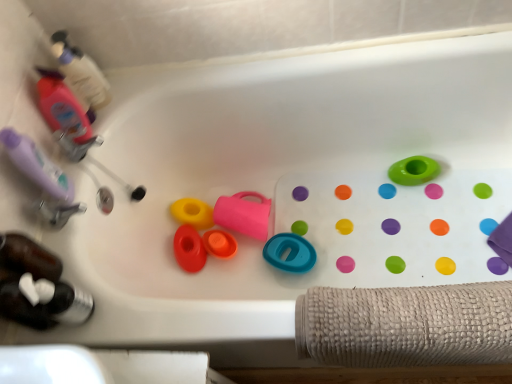
The height and width of the screenshot is (384, 512). Find the location of `free space to the right of translucent plastic bottle at lower left, the third bottle in the top-to-bottom sequence`. free space to the right of translucent plastic bottle at lower left, the third bottle in the top-to-bottom sequence is located at coordinates [x=124, y=307].